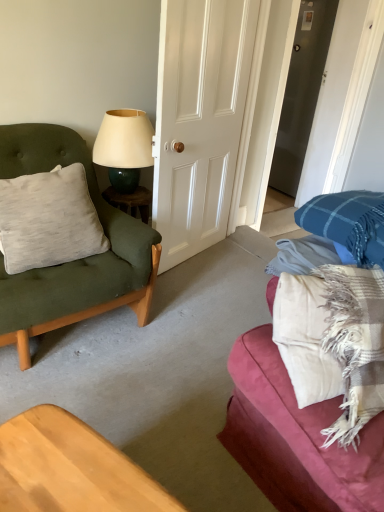
This screenshot has height=512, width=384. Describe the element at coordinates (124, 147) in the screenshot. I see `matte cream lampshade at upper center` at that location.

I want to click on light gray cotton pillow at left, so click(48, 220).

Does point (80, 213) come behind point (134, 160)?

That is False.

How many degrees apart are the facing directions of light gray cotton pillow at left and matte cream lampshade at upper center?

light gray cotton pillow at left and matte cream lampshade at upper center are facing 5.59 degrees away from each other.

Who is more distant, light gray cotton pillow at left or matte cream lampshade at upper center?

matte cream lampshade at upper center is further away from the camera.

Can you confirm if light gray cotton pillow at left is positioned to the left of matte cream lampshade at upper center?

Indeed, light gray cotton pillow at left is positioned on the left side of matte cream lampshade at upper center.

Can we say matte cream lampshade at upper center lies outside plaid fabric couch at right?

That's correct, matte cream lampshade at upper center is outside of plaid fabric couch at right.

Is point (124, 162) positioned in front of point (294, 406)?

No, (124, 162) is behind (294, 406).

Considering the positions of objects matte cream lampshade at upper center and plaid fabric couch at right in the image provided, who is more to the right, matte cream lampshade at upper center or plaid fabric couch at right?

plaid fabric couch at right is more to the right.

Which of these two, matte cream lampshade at upper center or plaid fabric couch at right, is wider?

Wider between the two is plaid fabric couch at right.

Does matte green cushion at left have a greater height compared to plaid fabric couch at right?

Yes, matte green cushion at left is taller than plaid fabric couch at right.

Can you confirm if matte green cushion at left is bigger than plaid fabric couch at right?

No.

Does matte green cushion at left have a lesser width compared to plaid fabric couch at right?

Yes, matte green cushion at left is thinner than plaid fabric couch at right.

Is matte green cushion at left not near plaid fabric couch at right?

That's not correct — matte green cushion at left is a little close to plaid fabric couch at right.

Measure the distance from plaid fabric couch at right to matte green cushion at left.

A distance of 33.11 inches exists between plaid fabric couch at right and matte green cushion at left.

Considering their positions, is plaid fabric couch at right located in front of or behind matte green cushion at left?

plaid fabric couch at right is positioned closer to the viewer than matte green cushion at left.

Is plaid fabric couch at right outside of matte green cushion at left?

Yes, plaid fabric couch at right is outside of matte green cushion at left.

How different are the orientations of plaid fabric couch at right and matte green cushion at left in degrees?

86 degrees separate the facing orientations of plaid fabric couch at right and matte green cushion at left.

How different are the orientations of plaid fabric couch at right and white glossy door at center in degrees?

The facing directions of plaid fabric couch at right and white glossy door at center are 106 degrees apart.

From the image's perspective, is plaid fabric couch at right beneath white glossy door at center?

Yes, from the image's perspective, plaid fabric couch at right is beneath white glossy door at center.

Which of these two, plaid fabric couch at right or white glossy door at center, is smaller?

With smaller size is white glossy door at center.

In the scene shown: Is the surface of matte cream lampshade at upper center in direct contact with light gray cotton pillow at left?

No, matte cream lampshade at upper center is not next to light gray cotton pillow at left.

At what (x,y) coordinates should I click in order to perform the action: click on lamp behind the light gray cotton pillow at left. Please return your answer as a coordinate pair (x, y). The width and height of the screenshot is (384, 512). Looking at the image, I should click on (124, 147).

Can you tell me how much matte green cushion at left and light gray cotton pillow at left differ in facing direction?

The facing directions of matte green cushion at left and light gray cotton pillow at left are 0.000483 degrees apart.

Is the surface of matte green cushion at left in direct contact with light gray cotton pillow at left?

There is a gap between matte green cushion at left and light gray cotton pillow at left.

Is matte green cushion at left aimed at light gray cotton pillow at left?

Yes, matte green cushion at left is oriented towards light gray cotton pillow at left.

Does matte green cushion at left have a larger size compared to light gray cotton pillow at left?

Correct, matte green cushion at left is larger in size than light gray cotton pillow at left.

You are a GUI agent. You are given a task and a screenshot of the screen. Output one action in this format:
    pyautogui.click(x=<x>, y=<y>)
    Task: Click on the lamp that appears on the right of light gray cotton pillow at left
    
    Given the screenshot: What is the action you would take?
    pyautogui.click(x=124, y=147)

Find the location of a particular element. studio couch below the matte cream lampshade at upper center (from a real-world perspective) is located at coordinates (294, 437).

When comparing their distances from matte cream lampshade at upper center, does white glossy door at center or light gray cotton pillow at left seem further?

light gray cotton pillow at left lies further to matte cream lampshade at upper center than the other object.

Looking at the image, which one is located further to plaid fabric couch at right, matte cream lampshade at upper center or matte green cushion at left?

matte cream lampshade at upper center lies further to plaid fabric couch at right than the other object.

Consider the image. Considering their positions, is light gray cotton pillow at left positioned closer to matte green cushion at left than plaid fabric couch at right?

light gray cotton pillow at left lies closer to matte green cushion at left than the other object.

Which object lies nearer to the anchor point white glossy door at center, matte cream lampshade at upper center or matte green cushion at left?

matte cream lampshade at upper center.

Looking at the image, which one is located closer to white glossy door at center, matte green cushion at left or matte cream lampshade at upper center?

matte cream lampshade at upper center is positioned closer to the anchor white glossy door at center.

Which object lies nearer to the anchor point matte green cushion at left, white glossy door at center or matte cream lampshade at upper center?

matte cream lampshade at upper center is closer to matte green cushion at left.

Which object lies nearer to the anchor point light gray cotton pillow at left, matte cream lampshade at upper center or plaid fabric couch at right?

Based on the image, matte cream lampshade at upper center appears to be nearer to light gray cotton pillow at left.

Considering their positions, is matte cream lampshade at upper center positioned closer to matte green cushion at left than light gray cotton pillow at left?

light gray cotton pillow at left lies closer to matte green cushion at left than the other object.

At what (x,y) coordinates should I click in order to perform the action: click on door located between light gray cotton pillow at left and plaid fabric couch at right in the left-right direction. Please return your answer as a coordinate pair (x, y). The image size is (384, 512). Looking at the image, I should click on (199, 119).

Image resolution: width=384 pixels, height=512 pixels. In order to click on chair situated between light gray cotton pillow at left and plaid fabric couch at right from left to right in this screenshot , I will do `click(74, 261)`.

Locate an element on the screen. Image resolution: width=384 pixels, height=512 pixels. lamp between light gray cotton pillow at left and plaid fabric couch at right is located at coordinates (124, 147).

The width and height of the screenshot is (384, 512). Identify the location of lamp situated between matte green cushion at left and white glossy door at center from left to right. (124, 147).